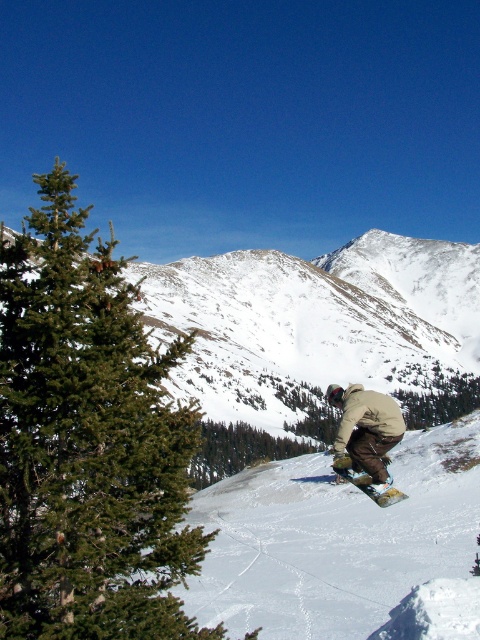
You are an observer standing at the edge of the snowy mountain at center and want to look towards the tan fabric snowboarder at center. In which direction should you turn your head?

You should turn your head to the left because the snowy mountain at center is on the right side of the tan fabric snowboarder at center, meaning the snowboarder is to the left of the mountain from your perspective.

You are standing in the winter scene and want to place a small flag at the point closer to you between the two points marked as point (x=243, y=426) and point (x=348, y=480). Which coordinate should you choose?

You should choose point (x=243, y=426) because it is closer to you than point (x=348, y=480).

You are planning to take a photo of the snowy mountain at center and the tan fabric snowboarder at center. Which object should you focus on first if you want to capture both in the same frame without moving the camera?

You should focus on the snowy mountain at center first because it is larger in size than the tan fabric snowboarder at center, allowing you to ensure it fits properly in the frame before adjusting for the smaller snowboarder.